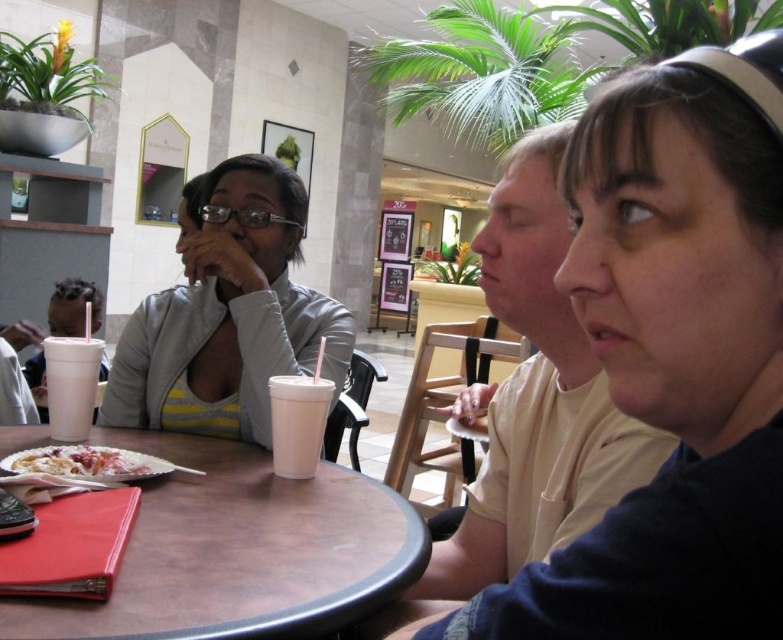
Question: Does dark blue fabric headband at upper right have a lesser width compared to white creamy dessert at table center?

Choices:
 (A) no
 (B) yes

Answer: (A)

Question: Which of the following is the closest to the observer?

Choices:
 (A) (45, 451)
 (B) (316, 403)

Answer: (A)

Question: Which object is positioned farthest from the light gray jacket at upper left?

Choices:
 (A) white matte cup at table center
 (B) white creamy dessert at table center

Answer: (B)

Question: Can you confirm if brown laminate table at lower left is bigger than white matte cup at table center?

Choices:
 (A) no
 (B) yes

Answer: (B)

Question: Among these points, which one is farthest from the camera?

Choices:
 (A) (150, 468)
 (B) (325, 404)
 (C) (258, 212)
 (D) (717, 83)

Answer: (C)

Question: Is brown laminate table at lower left behind white matte cup at table left?

Choices:
 (A) no
 (B) yes

Answer: (A)